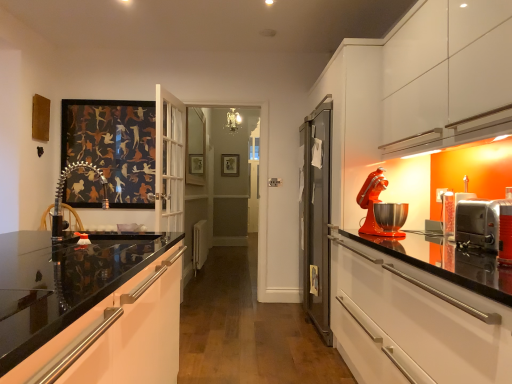
Question: Is glossy white cabinet at lower left positioned beyond the bounds of metallic silver chair at left?

Choices:
 (A) no
 (B) yes

Answer: (B)

Question: From the image's perspective, is glossy white cabinet at lower left above metallic silver chair at left?

Choices:
 (A) yes
 (B) no

Answer: (B)

Question: From a real-world perspective, is glossy white cabinet at lower left physically above metallic silver chair at left?

Choices:
 (A) yes
 (B) no

Answer: (B)

Question: Is glossy white cabinet at lower left thinner than metallic silver chair at left?

Choices:
 (A) no
 (B) yes

Answer: (A)

Question: Is metallic silver chair at left at the back of glossy white cabinet at lower left?

Choices:
 (A) yes
 (B) no

Answer: (B)

Question: Based on their positions, is clear glass mirror at center located to the left or right of glossy white cabinet at lower left?

Choices:
 (A) left
 (B) right

Answer: (A)

Question: Is clear glass mirror at center bigger or smaller than glossy white cabinet at lower left?

Choices:
 (A) small
 (B) big

Answer: (A)

Question: Looking at their shapes, would you say clear glass mirror at center is wider or thinner than glossy white cabinet at lower left?

Choices:
 (A) thin
 (B) wide

Answer: (A)

Question: Relative to glossy white cabinet at lower left, is clear glass mirror at center in front or behind?

Choices:
 (A) behind
 (B) front

Answer: (A)

Question: Looking at their shapes, would you say metallic silver chair at left is wider or thinner than gold metallic picture frame at center?

Choices:
 (A) wide
 (B) thin

Answer: (A)

Question: Considering the positions of metallic silver chair at left and gold metallic picture frame at center in the image, is metallic silver chair at left bigger or smaller than gold metallic picture frame at center?

Choices:
 (A) big
 (B) small

Answer: (A)

Question: In the image, is metallic silver chair at left positioned in front of or behind gold metallic picture frame at center?

Choices:
 (A) behind
 (B) front

Answer: (B)

Question: From a real-world perspective, is metallic silver chair at left above or below gold metallic picture frame at center?

Choices:
 (A) below
 (B) above

Answer: (A)

Question: Which is correct: matte orange mixer at right is inside stainless steel toaster oven at right, the 1th appliance in the front-to-back sequence, or outside of it?

Choices:
 (A) outside
 (B) inside

Answer: (A)

Question: Looking at their shapes, would you say matte orange mixer at right is wider or thinner than stainless steel toaster oven at right, the 1th appliance in the front-to-back sequence?

Choices:
 (A) wide
 (B) thin

Answer: (B)